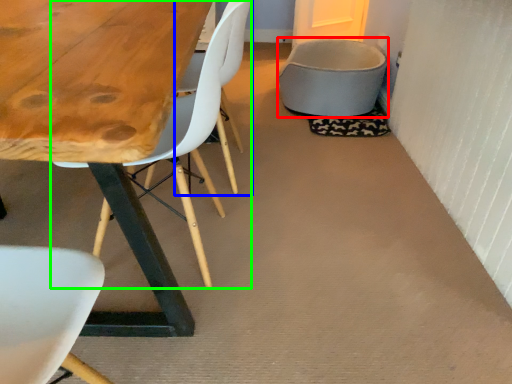
Question: Which object is positioned closest to gray (highlighted by a red box)? Select from armchair (highlighted by a blue box) and chair (highlighted by a green box).

Choices:
 (A) armchair
 (B) chair

Answer: (A)